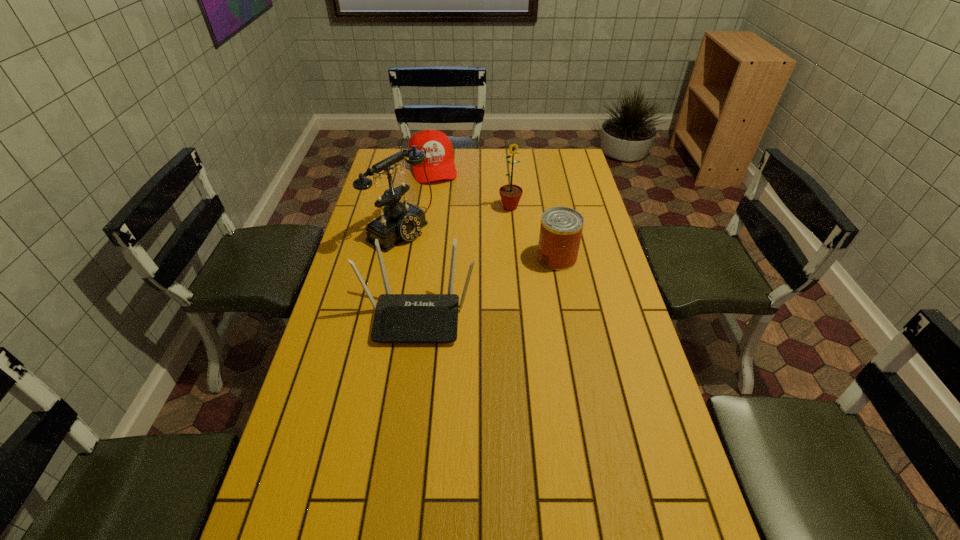
What are the coordinates of `telephone at the left edge` in the screenshot? It's located at (400, 221).

You are a GUI agent. You are given a task and a screenshot of the screen. Output one action in this format:
    pyautogui.click(x=<x>, y=<y>)
    Task: Click on the object present at the right edge
    This screenshot has width=960, height=540.
    Given the screenshot: What is the action you would take?
    pyautogui.click(x=561, y=228)

Where is `object located at the far left corner`? object located at the far left corner is located at coordinates (439, 164).

Identify the location of vacant area at the far edge of the desktop. The width and height of the screenshot is (960, 540). (458, 175).

The image size is (960, 540). In the image, there is a desktop. What are the coordinates of `blank space at the near edge` in the screenshot? It's located at (409, 502).

Locate an element on the screen. This screenshot has height=540, width=960. vacant space at the left edge of the desktop is located at coordinates (328, 347).

I want to click on vacant region at the right edge of the desktop, so click(598, 318).

Where is `vacant area at the far right corner of the desktop`? vacant area at the far right corner of the desktop is located at coordinates (571, 171).

This screenshot has height=540, width=960. In order to click on free space that is in between the baseball cap and the telephone in this screenshot , I will do `click(417, 198)`.

In order to click on free point between the farthest object and the nearest object in this screenshot , I will do `click(425, 241)`.